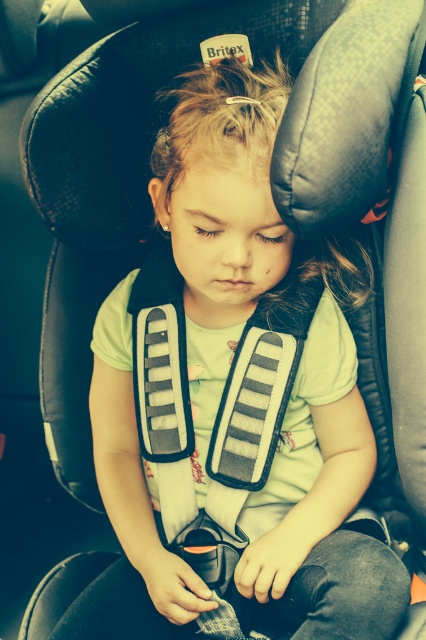
Is green matte vest at center smaller than matte gray safety vest at center?

No, green matte vest at center is not smaller than matte gray safety vest at center.

Does green matte vest at center have a greater width compared to matte gray safety vest at center?

Indeed, green matte vest at center has a greater width compared to matte gray safety vest at center.

Which is in front, point (210, 589) or point (189, 497)?

Point (210, 589) is more forward.

Identify the location of green matte vest at center. (299, 364).